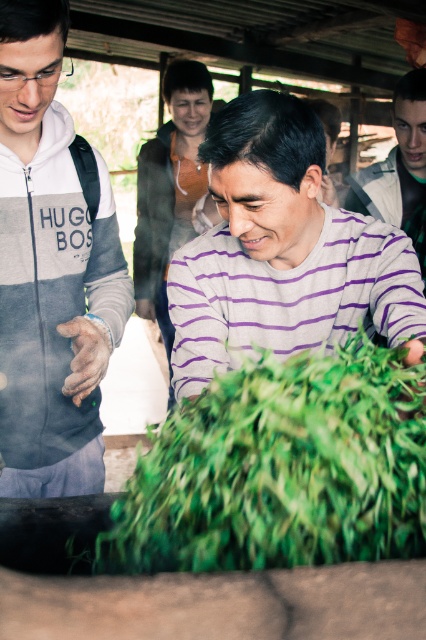
Question: Which point is closer to the camera?

Choices:
 (A) (299, 276)
 (B) (157, 278)
 (C) (26, 204)
 (D) (123, 532)

Answer: (D)

Question: Is matte orange sweater at upper center to the right of purple striped sweater at center from the viewer's perspective?

Choices:
 (A) yes
 (B) no

Answer: (B)

Question: Is gray fleece jacket at left positioned before purple striped shirt at center?

Choices:
 (A) yes
 (B) no

Answer: (A)

Question: Which point is farther to the camera?

Choices:
 (A) (37, 68)
 (B) (195, 92)
 (C) (288, 220)

Answer: (B)

Question: In this image, where is gray fleece jacket at left located relative to matte orange sweater at upper center?

Choices:
 (A) below
 (B) above

Answer: (A)

Question: Estimate the real-world distances between objects in this image. Which object is farther from the purple striped sweater at center?

Choices:
 (A) matte orange sweater at upper center
 (B) green leafy vegetable at center
 (C) purple striped shirt at center
 (D) gray fleece jacket at left

Answer: (B)